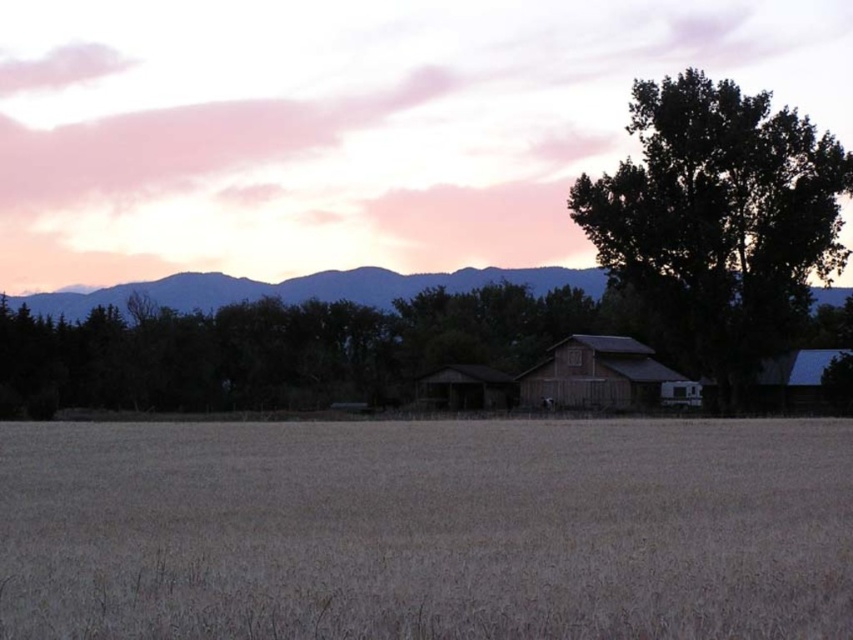
Question: Which of the following is the farthest from the observer?

Choices:
 (A) dark green leafy tree at center
 (B) wooden barn at center
 (C) brown grassy field at lower center

Answer: (B)

Question: Is brown grassy field at lower center above dark green leafy tree at center?

Choices:
 (A) no
 (B) yes

Answer: (A)

Question: Does brown grassy field at lower center appear on the right side of wooden barn at center?

Choices:
 (A) no
 (B) yes

Answer: (A)

Question: Which point is farther to the camera?

Choices:
 (A) (844, 256)
 (B) (538, 378)
 (C) (753, 534)

Answer: (B)

Question: Is brown grassy field at lower center closer to the viewer compared to dark green leafy tree at center?

Choices:
 (A) yes
 (B) no

Answer: (A)

Question: Which object is positioned closest to the brown grassy field at lower center?

Choices:
 (A) wooden barn at center
 (B) dark green leafy tree at center

Answer: (B)